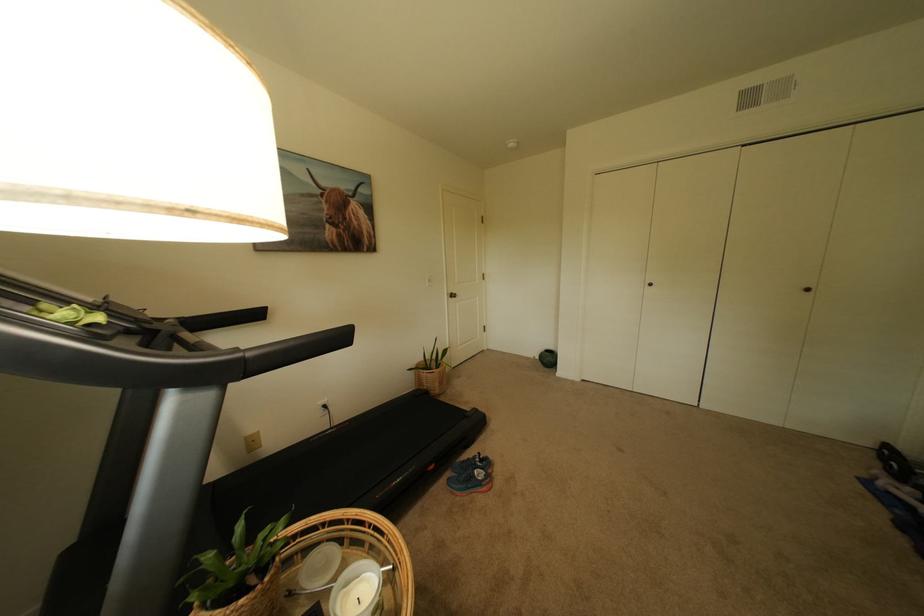
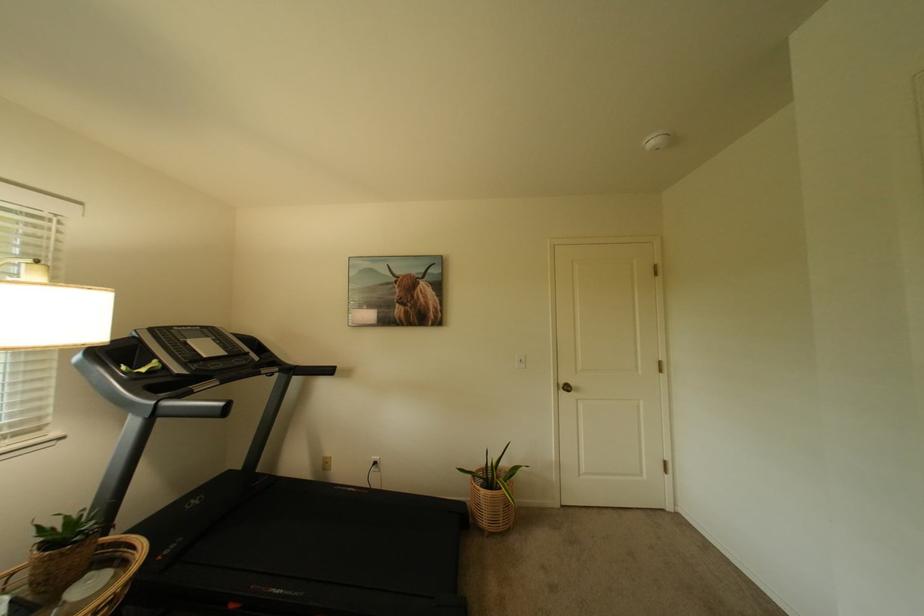
Where in the second image is the point corresponding to point (457, 296) from the first image?

(569, 386)